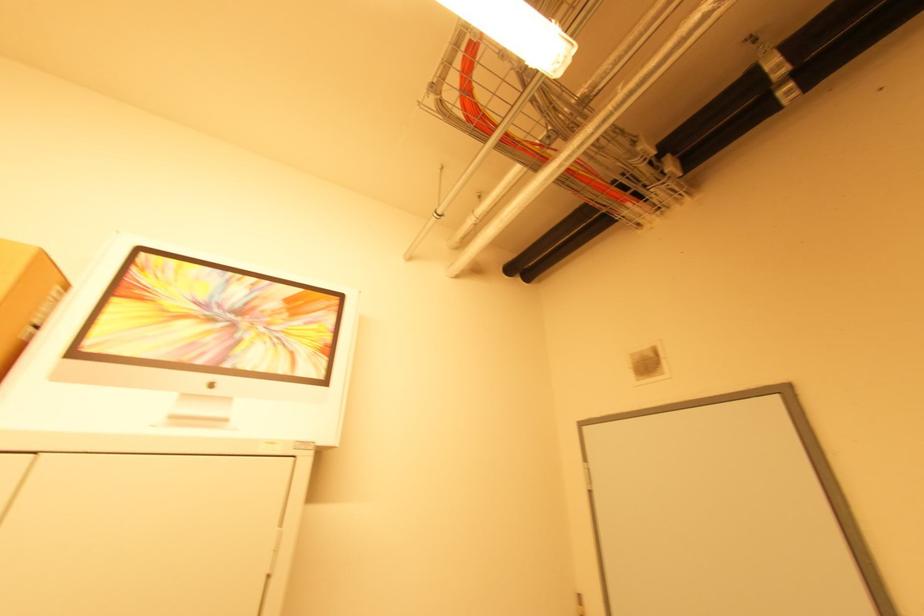
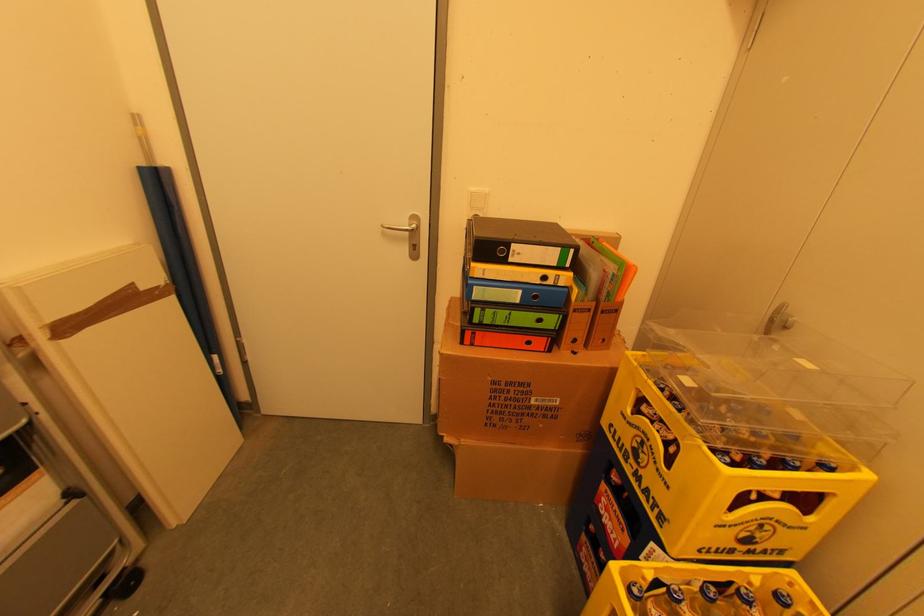
Consider the image. How did the camera likely rotate?

The camera rotated toward right-down.